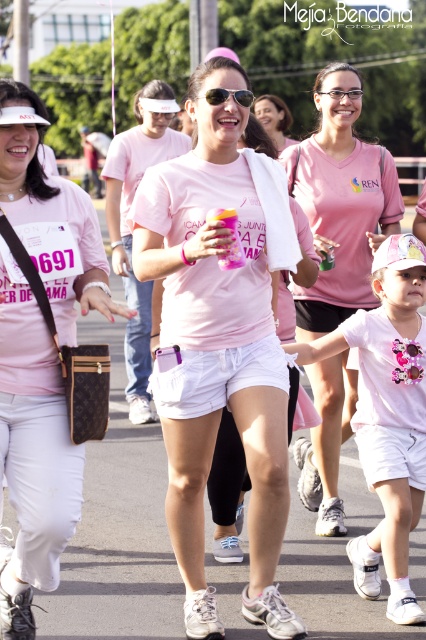
Question: Is matte pink shirt at center to the left of black reflective sunglasses at center from the viewer's perspective?

Choices:
 (A) yes
 (B) no

Answer: (A)

Question: From the image, what is the correct spatial relationship of matte pink shirt at center in relation to pink fabric shirt at center?

Choices:
 (A) below
 (B) above

Answer: (A)

Question: Which object is the closest to the pink matte t-shirt at center?

Choices:
 (A) white cotton shirt at center
 (B) matte pink t-shirt at center
 (C) pink fabric shirt at center
 (D) pink fabric shorts at center

Answer: (C)

Question: Can you confirm if pink matte t-shirt at center is positioned to the right of pink fabric shirt at center?

Choices:
 (A) yes
 (B) no

Answer: (A)

Question: Which of the following is the closest to the observer?

Choices:
 (A) 244,106
 (B) 405,582
 (C) 377,205
 (D) 273,332

Answer: (A)

Question: Based on their relative distances, which object is nearer to the pink fabric shorts at center?

Choices:
 (A) white cotton shirt at center
 (B) matte pink shirt at center
 (C) black reflective sunglasses at center

Answer: (C)